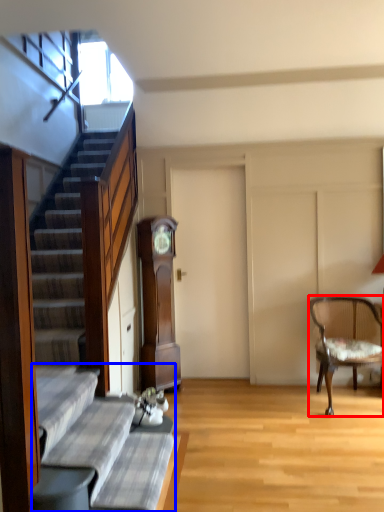
Question: Which of the following is the farthest to the observer, chair (highlighted by a red box) or couch (highlighted by a blue box)?

Choices:
 (A) chair
 (B) couch

Answer: (A)